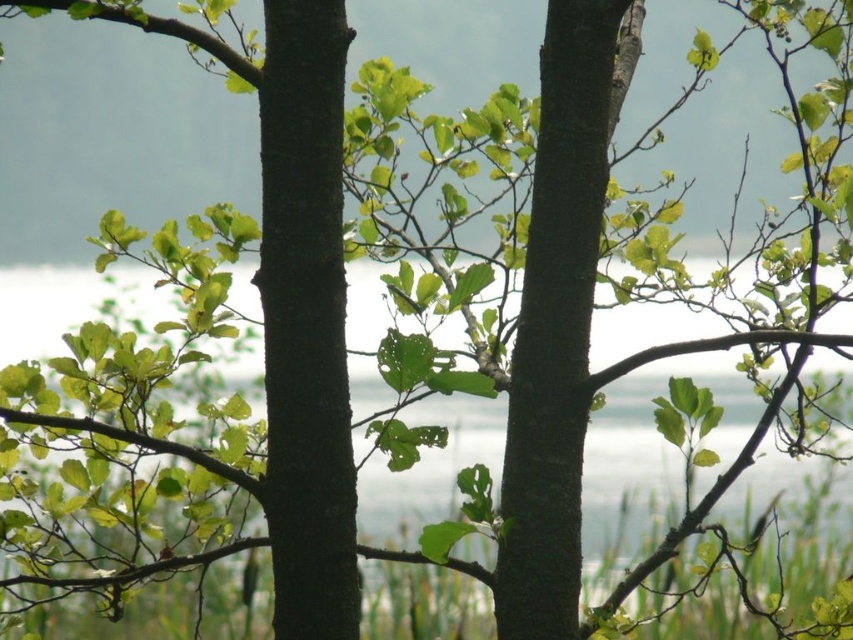
Question: Is the position of dark brown rough tree trunk at center more distant than that of smooth bark tree trunk at center?

Choices:
 (A) yes
 (B) no

Answer: (B)

Question: Can you confirm if dark brown rough tree trunk at center is thinner than smooth bark tree trunk at center?

Choices:
 (A) no
 (B) yes

Answer: (B)

Question: Does dark brown rough tree trunk at center appear on the right side of smooth bark tree trunk at center?

Choices:
 (A) no
 (B) yes

Answer: (A)

Question: Which point appears closest to the camera in this image?

Choices:
 (A) (306, 432)
 (B) (521, 424)

Answer: (A)

Question: Which of the following is the farthest from the observer?

Choices:
 (A) (323, 136)
 (B) (518, 355)

Answer: (B)